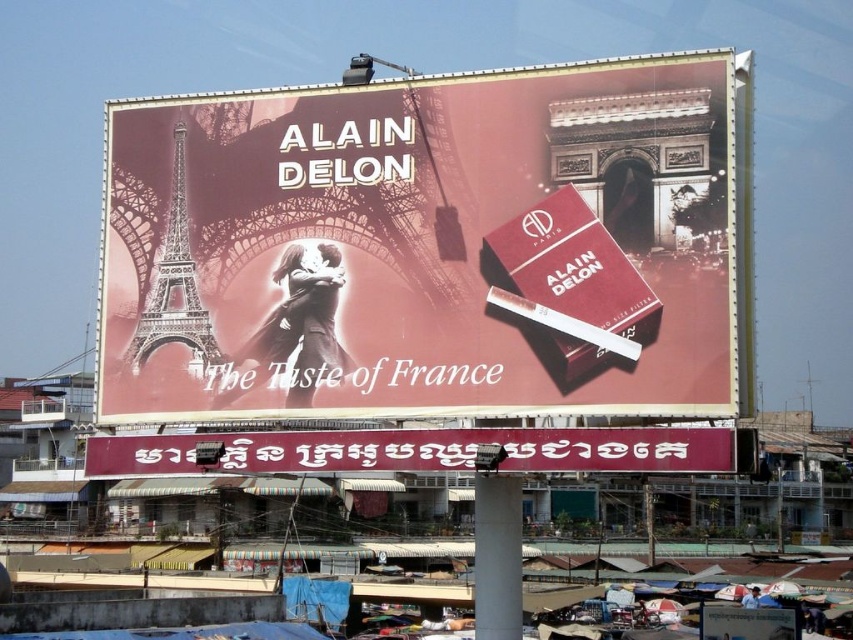
You are standing in front of the Alain Delon billboard and want to locate the maroon fabric banner at lower center. According to the coordinates provided, where should you look on the billboard?

The maroon fabric banner at lower center is located at point 0.705 on the horizontal axis and 0.492 on the vertical axis of the billboard.

You are a graphic designer reviewing the billboard layout. You need to ensure that the matte red cigarette pack at center and the maroon fabric banner at lower center are positioned correctly according to the client specifications. Based on the scene description, which object is placed higher on the billboard?

The matte red cigarette pack at center is placed higher than the maroon fabric banner at lower center according to the description.

You are designing a layout for a new advertisement and need to place two elements on the billboard. You have a matte red cigarette pack at center and a maroon fabric banner at lower center. According to the existing design, which object is wider?

The matte red cigarette pack at center might be wider than maroon fabric banner at lower center, so it is likely the wider one.